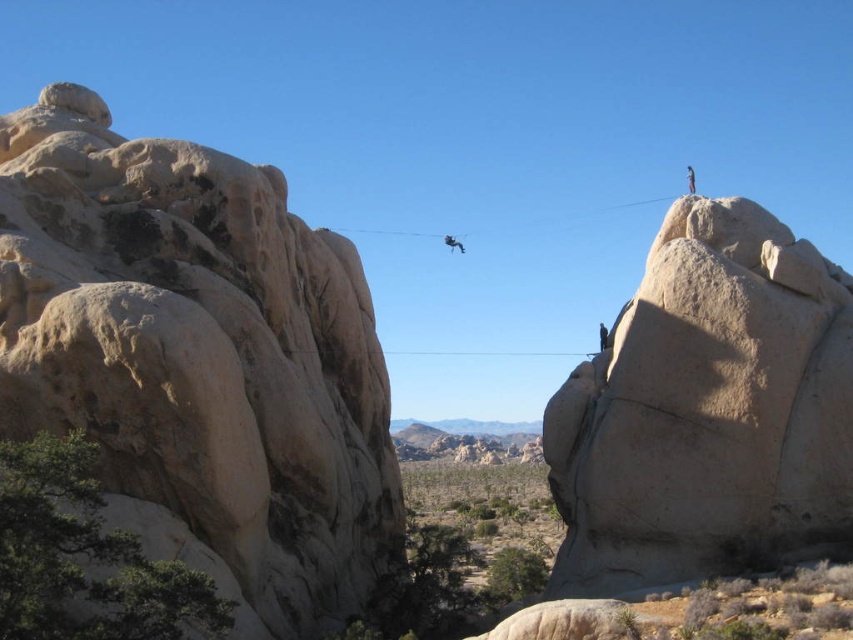
Does beige rough rock at left have a lesser width compared to smooth beige rock at upper right?

In fact, beige rough rock at left might be wider than smooth beige rock at upper right.

Which of these two, beige rough rock at left or smooth beige rock at upper right, stands shorter?

Standing shorter between the two is smooth beige rock at upper right.

Who is more forward, (337, 604) or (781, 304)?

Positioned in front is point (781, 304).

Where is `beige rough rock at left`? The width and height of the screenshot is (853, 640). beige rough rock at left is located at coordinates (198, 358).